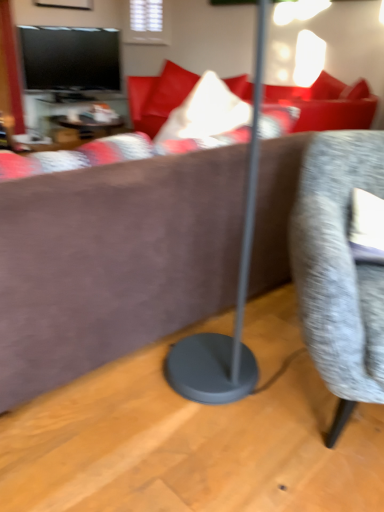
Question: Should I look upward or downward to see wooden table at center?

Choices:
 (A) down
 (B) up

Answer: (B)

Question: Is there a large distance between brown suede couch at center and wooden table at center?

Choices:
 (A) yes
 (B) no

Answer: (A)

Question: Considering the relative positions of brown suede couch at center and wooden table at center in the image provided, is brown suede couch at center behind wooden table at center?

Choices:
 (A) no
 (B) yes

Answer: (A)

Question: Is brown suede couch at center oriented towards wooden table at center?

Choices:
 (A) no
 (B) yes

Answer: (A)

Question: From the image's perspective, is brown suede couch at center beneath wooden table at center?

Choices:
 (A) no
 (B) yes

Answer: (B)

Question: From a real-world perspective, does brown suede couch at center stand above wooden table at center?

Choices:
 (A) yes
 (B) no

Answer: (A)

Question: From a real-world perspective, is brown suede couch at center located beneath wooden table at center?

Choices:
 (A) yes
 (B) no

Answer: (B)

Question: Does textured gray chair at right have a larger size compared to wooden table at center?

Choices:
 (A) yes
 (B) no

Answer: (A)

Question: From the image's perspective, is textured gray chair at right beneath wooden table at center?

Choices:
 (A) no
 (B) yes

Answer: (B)

Question: Considering the relative sizes of textured gray chair at right and wooden table at center in the image provided, is textured gray chair at right wider than wooden table at center?

Choices:
 (A) yes
 (B) no

Answer: (A)

Question: Is textured gray chair at right at the left side of wooden table at center?

Choices:
 (A) yes
 (B) no

Answer: (B)

Question: Is textured gray chair at right further to camera compared to wooden table at center?

Choices:
 (A) yes
 (B) no

Answer: (B)

Question: Considering the relative sizes of textured gray chair at right and wooden table at center in the image provided, is textured gray chair at right shorter than wooden table at center?

Choices:
 (A) no
 (B) yes

Answer: (A)

Question: Can you confirm if wooden table at center is taller than textured gray chair at right?

Choices:
 (A) yes
 (B) no

Answer: (B)